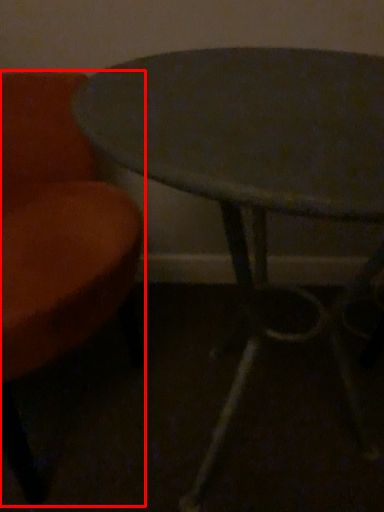
Question: From the image's perspective, what is the correct spatial relationship of chair (annotated by the red box) in relation to table?

Choices:
 (A) above
 (B) below

Answer: (A)